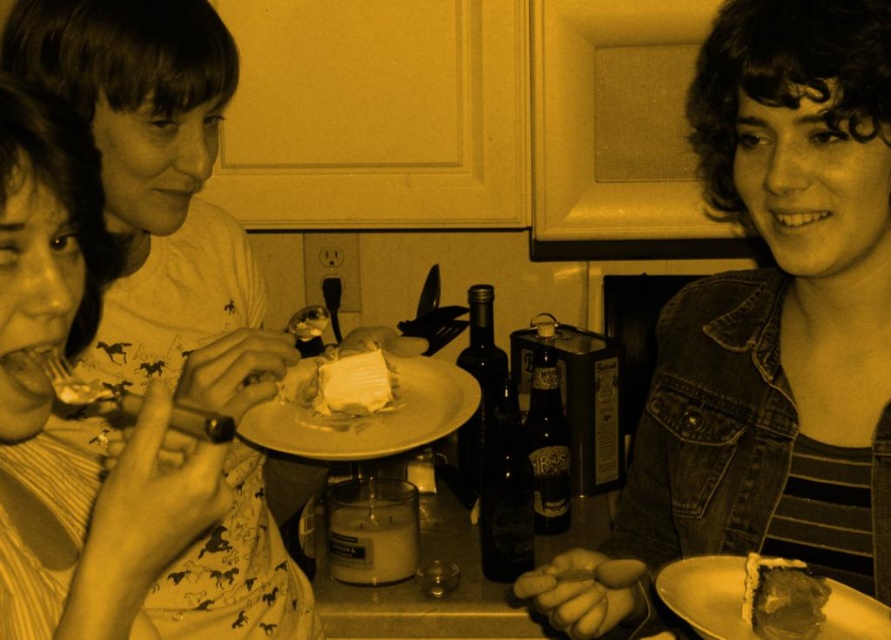
Question: Which object appears farthest from the camera in this image?

Choices:
 (A) matte white shirt at upper left
 (B) white matte plate at center

Answer: (B)

Question: Does matte white shirt at upper left have a smaller size compared to white crumbly cake at center?

Choices:
 (A) yes
 (B) no

Answer: (B)

Question: Which object is the farthest from the white matte plate at center?

Choices:
 (A) matte white shirt at upper left
 (B) white crumbly cake at center
 (C) matte white plate at lower right

Answer: (C)

Question: Does denim jacket at upper right lie behind dark brown cake at lower right?

Choices:
 (A) no
 (B) yes

Answer: (B)

Question: Among these points, which one is nearest to the camera?

Choices:
 (A) (340, 458)
 (B) (151, 509)
 (C) (865, 580)
 (D) (740, 637)

Answer: (B)

Question: Does matte white shirt at upper left have a larger size compared to white crumbly cake at center?

Choices:
 (A) yes
 (B) no

Answer: (A)